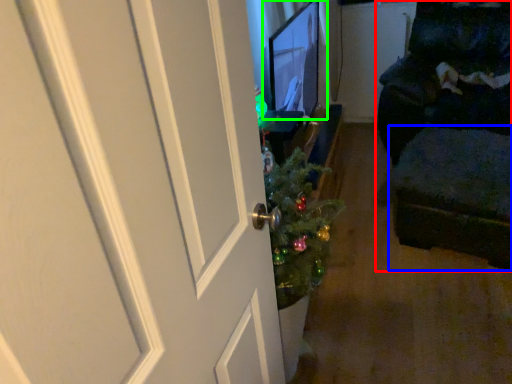
Question: Which object is positioned farthest from furniture (highlighted by a red box)? Select from footrest (highlighted by a blue box) and computer monitor (highlighted by a green box).

Choices:
 (A) footrest
 (B) computer monitor

Answer: (B)